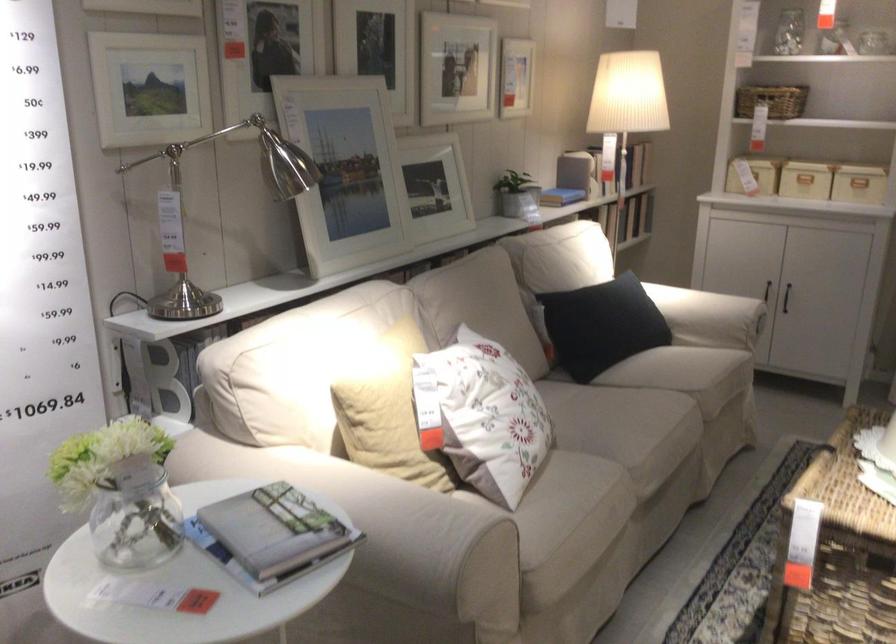
Describe the element at coordinates (171, 149) in the screenshot. I see `the silver lamp joint` at that location.